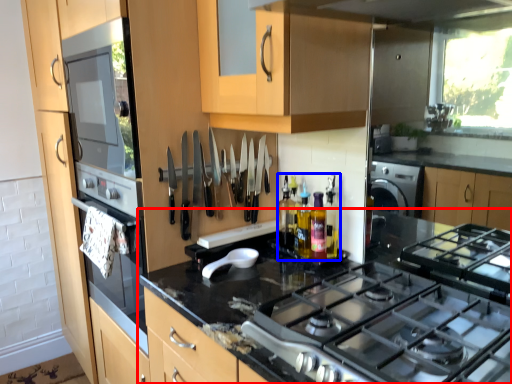
Question: Which object appears closest to the camera in this image, countertop (highlighted by a red box) or bottle (highlighted by a blue box)?

Choices:
 (A) countertop
 (B) bottle

Answer: (A)